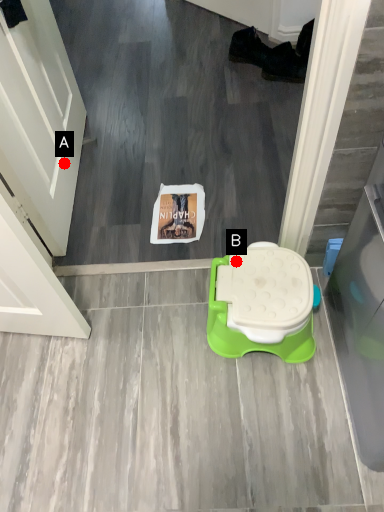
Question: Two points are circled on the image, labeled by A and B beside each circle. Which point is closer to the camera?

Choices:
 (A) A is closer
 (B) B is closer

Answer: (B)